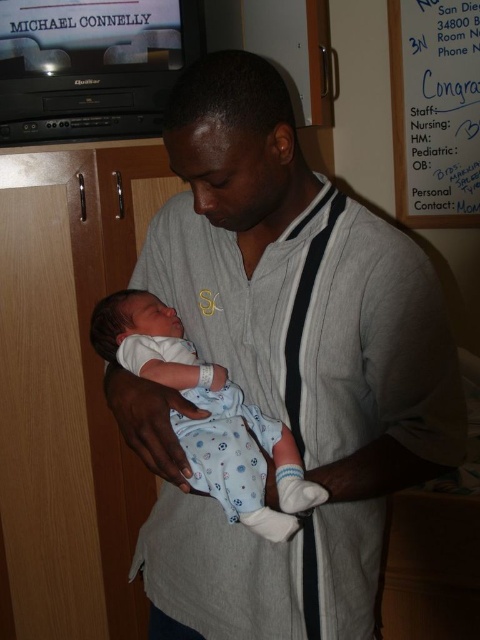
Does gray cotton shirt at center have a smaller size compared to white paper at upper right?

No.

Is point (402, 275) positioned in front of point (466, 220)?

Yes, point (402, 275) is in front of point (466, 220).

Where is `gray cotton shirt at center`? Image resolution: width=480 pixels, height=640 pixels. gray cotton shirt at center is located at coordinates (284, 365).

Is gray cotton shirt at center thinner than blue cotton onesie at center?

In fact, gray cotton shirt at center might be wider than blue cotton onesie at center.

Does gray cotton shirt at center lie in front of blue cotton onesie at center?

Yes, gray cotton shirt at center is closer to the viewer.

Between point (206, 83) and point (276, 420), which one is positioned behind?

Point (276, 420)

Where is `gray cotton shirt at center`? This screenshot has height=640, width=480. gray cotton shirt at center is located at coordinates (284, 365).

Is blue cotton onesie at center to the left of white paper at upper right from the viewer's perspective?

Indeed, blue cotton onesie at center is positioned on the left side of white paper at upper right.

Does blue cotton onesie at center have a lesser height compared to white paper at upper right?

Correct, blue cotton onesie at center is not as tall as white paper at upper right.

Image resolution: width=480 pixels, height=640 pixels. What do you see at coordinates (208, 413) in the screenshot? I see `blue cotton onesie at center` at bounding box center [208, 413].

Locate an element on the screen. The height and width of the screenshot is (640, 480). blue cotton onesie at center is located at coordinates (208, 413).